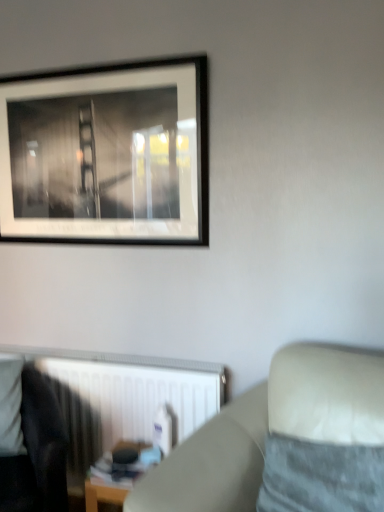
Question: Looking at the image, does beige fabric couch at lower right seem bigger or smaller compared to black matte picture frame at upper left?

Choices:
 (A) small
 (B) big

Answer: (B)

Question: Considering their positions, is beige fabric couch at lower right located in front of or behind black matte picture frame at upper left?

Choices:
 (A) front
 (B) behind

Answer: (A)

Question: Considering the real-world distances, which object is farthest from the wooden table at lower center?

Choices:
 (A) dark fabric rocking chair at lower left
 (B) white plastic radiator at lower left
 (C) velvety gray pillow at lower right
 (D) beige fabric couch at lower right
 (E) black matte picture frame at upper left

Answer: (E)

Question: Estimate the real-world distances between objects in this image. Which object is farther from the beige fabric couch at lower right?

Choices:
 (A) dark fabric rocking chair at lower left
 (B) white plastic radiator at lower left
 (C) wooden table at lower center
 (D) black matte picture frame at upper left
 (E) velvety gray pillow at lower right

Answer: (D)